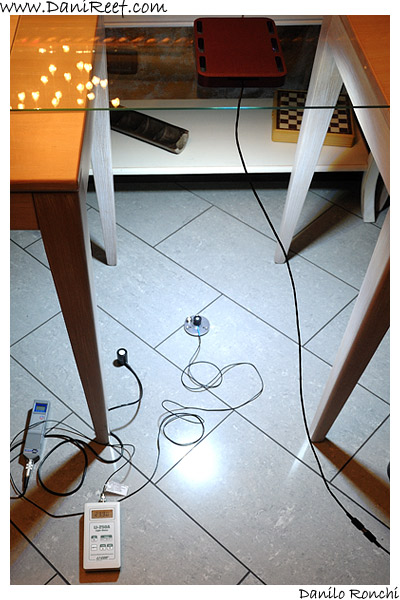
Find the location of a particular element. This screenshot has height=600, width=400. grout is located at coordinates (230, 551), (296, 457), (366, 441), (379, 396).